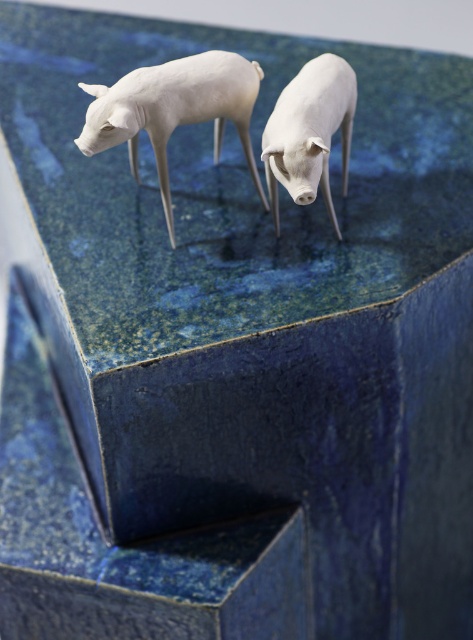
Is point (199, 100) positioned after point (296, 109)?

Yes, it is.

What do you see at coordinates (174, 109) in the screenshot?
I see `white matte lamb at center` at bounding box center [174, 109].

At what (x,y) coordinates should I click in order to perform the action: click on white matte lamb at center. Please return your answer as a coordinate pair (x, y). The height and width of the screenshot is (640, 473). Looking at the image, I should click on (174, 109).